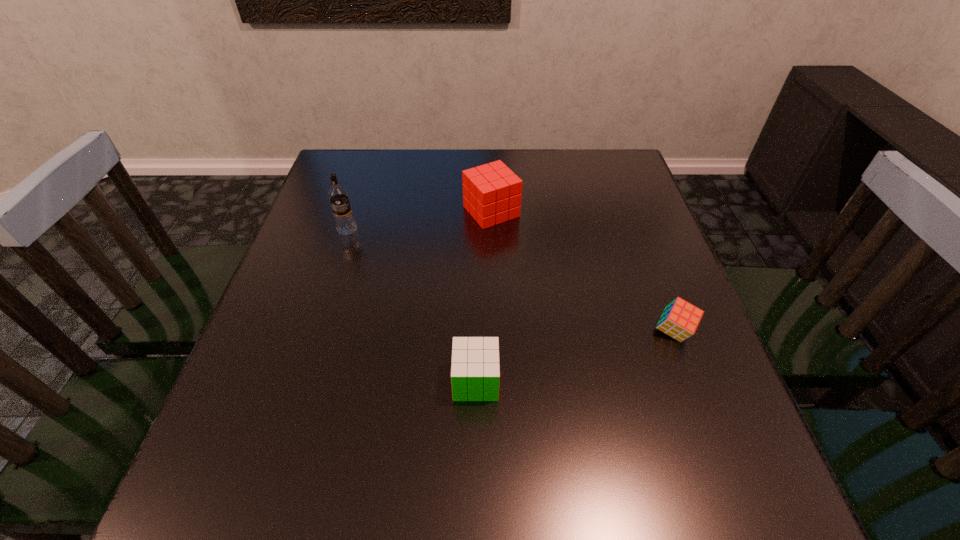
Locate an element on the screen. vodka is located at coordinates (345, 224).

Identify the location of the tallest object. Image resolution: width=960 pixels, height=540 pixels. (345, 224).

Where is `the third shortest object`? the third shortest object is located at coordinates (492, 195).

The width and height of the screenshot is (960, 540). In order to click on the tallest cube in this screenshot , I will do click(x=492, y=195).

Image resolution: width=960 pixels, height=540 pixels. What are the coordinates of `the nearest cube` in the screenshot? It's located at (475, 370).

You are a GUI agent. You are given a task and a screenshot of the screen. Output one action in this format:
    pyautogui.click(x=<x>, y=<y>)
    Task: Click on the rightmost object
    This screenshot has width=960, height=540.
    Given the screenshot: What is the action you would take?
    pyautogui.click(x=680, y=319)

Identify the location of the rightmost cube. The image size is (960, 540). (680, 319).

What are the coordinates of `free space located on the label of the leftmost object` in the screenshot? It's located at (300, 375).

Identify the location of vacant space located on the left of the second tallest object. The height and width of the screenshot is (540, 960). (417, 212).

At what (x,y) coordinates should I click in order to perform the action: click on vacant area situated on the left of the nearest object. Please return your answer as a coordinate pair (x, y). This screenshot has width=960, height=540. Looking at the image, I should click on (398, 381).